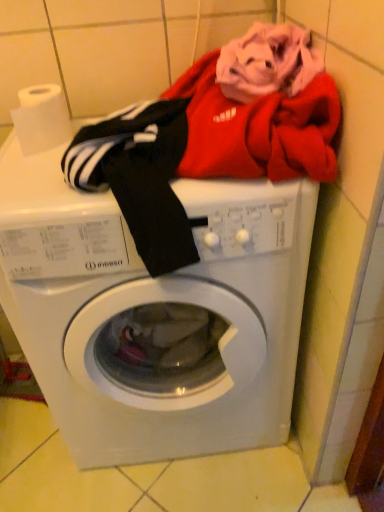
Find the location of a particular element. This screenshot has height=512, width=384. white matte toilet paper at upper left is located at coordinates (41, 118).

Describe the element at coordinates (41, 118) in the screenshot. I see `white matte toilet paper at upper left` at that location.

Measure the distance between white matte toilet paper at upper left and camera.

white matte toilet paper at upper left and camera are 31.82 inches apart from each other.

This screenshot has width=384, height=512. Describe the element at coordinates (155, 313) in the screenshot. I see `white plastic washing machine at center` at that location.

Image resolution: width=384 pixels, height=512 pixels. Identify the location of white plastic washing machine at center. (155, 313).

What is the approximate height of white plastic washing machine at center?

white plastic washing machine at center is 33.06 inches in height.

This screenshot has width=384, height=512. What are the coordinates of `white matte toilet paper at upper left` in the screenshot? It's located at (41, 118).

Does white plastic washing machine at center appear on the left side of white matte toilet paper at upper left?

No, white plastic washing machine at center is not to the left of white matte toilet paper at upper left.

Relative to white matte toilet paper at upper left, is white plastic washing machine at center in front or behind?

In the image, white plastic washing machine at center appears in front of white matte toilet paper at upper left.

Considering the points (267, 334) and (52, 93), which point is behind, point (267, 334) or point (52, 93)?

The point (267, 334) is farther.

From the image's perspective, between white plastic washing machine at center and white matte toilet paper at upper left, who is located below?

white plastic washing machine at center is shown below in the image.

From a real-world perspective, which is physically above, white plastic washing machine at center or white matte toilet paper at upper left?

In real-world perspective, white matte toilet paper at upper left is above.

In terms of width, does white plastic washing machine at center look wider or thinner when compared to white matte toilet paper at upper left?

Clearly, white plastic washing machine at center has more width compared to white matte toilet paper at upper left.

Is white plastic washing machine at center shorter than white matte toilet paper at upper left?

No, white plastic washing machine at center is not shorter than white matte toilet paper at upper left.

Can you confirm if white plastic washing machine at center is smaller than white matte toilet paper at upper left?

Incorrect, white plastic washing machine at center is not smaller in size than white matte toilet paper at upper left.

Could white matte toilet paper at upper left be considered to be inside white plastic washing machine at center?

No, white matte toilet paper at upper left is not inside white plastic washing machine at center.

Can you see white plastic washing machine at center touching white matte toilet paper at upper left?

white plastic washing machine at center is not next to white matte toilet paper at upper left, and they're not touching.

Does white plastic washing machine at center turn towards white matte toilet paper at upper left?

No.

At what (x,y) coordinates should I click in order to perform the action: click on toilet paper behind the white plastic washing machine at center. Please return your answer as a coordinate pair (x, y). The image size is (384, 512). Looking at the image, I should click on (41, 118).

Considering the relative positions of white matte toilet paper at upper left and white plastic washing machine at center in the image provided, is white matte toilet paper at upper left to the left or to the right of white plastic washing machine at center?

In the image, white matte toilet paper at upper left appears on the left side of white plastic washing machine at center.

Does white matte toilet paper at upper left come in front of white plastic washing machine at center?

No, white matte toilet paper at upper left is further to the viewer.

Between point (65, 140) and point (193, 404), which one is positioned in front?

The point (65, 140) is closer to the camera.

From the image's perspective, which one is positioned higher, white matte toilet paper at upper left or white plastic washing machine at center?

From the image's view, white matte toilet paper at upper left is above.

From a real-world perspective, is white matte toilet paper at upper left on white plastic washing machine at center?

Yes, from a real-world perspective, white matte toilet paper at upper left is above white plastic washing machine at center.

In terms of width, does white matte toilet paper at upper left look wider or thinner when compared to white plastic washing machine at center?

Considering their sizes, white matte toilet paper at upper left looks slimmer than white plastic washing machine at center.

Which of these two, white matte toilet paper at upper left or white plastic washing machine at center, stands shorter?

Standing shorter between the two is white matte toilet paper at upper left.

Considering the sizes of objects white matte toilet paper at upper left and white plastic washing machine at center in the image provided, who is bigger, white matte toilet paper at upper left or white plastic washing machine at center?

white plastic washing machine at center is bigger.

Do you think white matte toilet paper at upper left is within white plastic washing machine at center, or outside of it?

white matte toilet paper at upper left cannot be found inside white plastic washing machine at center.

Are white matte toilet paper at upper left and white plastic washing machine at center located far from each other?

No, white matte toilet paper at upper left is in close proximity to white plastic washing machine at center.

Is white matte toilet paper at upper left facing away from white plastic washing machine at center?

white matte toilet paper at upper left is not turned away from white plastic washing machine at center.

The image size is (384, 512). I want to click on washing machine below the white matte toilet paper at upper left (from the image's perspective), so click(x=155, y=313).

Identify the location of washing machine below the white matte toilet paper at upper left (from a real-world perspective). This screenshot has height=512, width=384. (155, 313).

The width and height of the screenshot is (384, 512). Find the location of `washing machine below the white matte toilet paper at upper left (from the image's perspective)`. washing machine below the white matte toilet paper at upper left (from the image's perspective) is located at coordinates (155, 313).